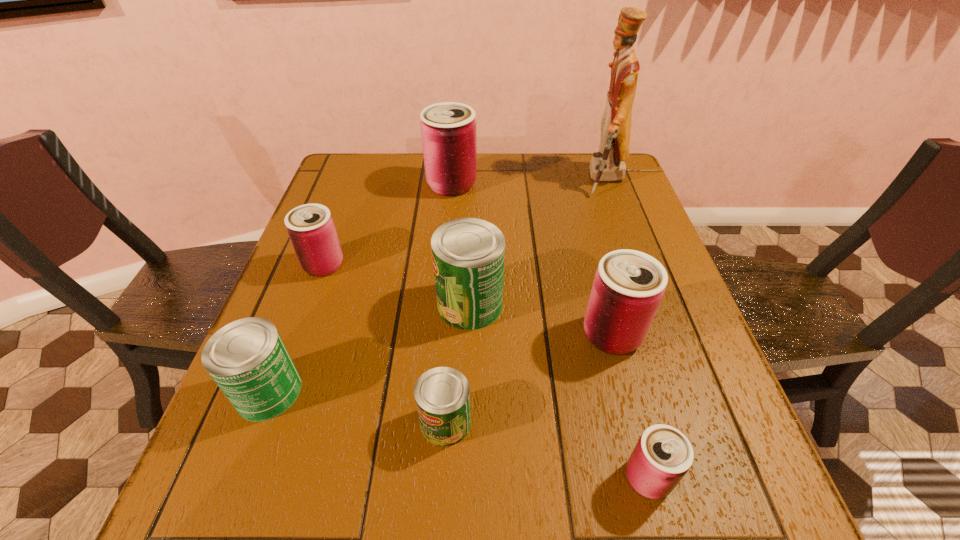
Find the location of a particular element. The width and height of the screenshot is (960, 540). nutcracker is located at coordinates pos(608,164).

You are a GUI agent. You are given a task and a screenshot of the screen. Output one action in this format:
    pyautogui.click(x=<x>, y=<y>)
    Task: Click on the red nutcracker
    The height and width of the screenshot is (540, 960).
    Given the screenshot: What is the action you would take?
    pyautogui.click(x=608, y=164)

Locate an element on the screen. the third pink can from right to left is located at coordinates (448, 129).

Locate an element on the screen. the tallest can is located at coordinates (448, 129).

Where is `the farthest green can`? the farthest green can is located at coordinates (468, 254).

Where is `the third farthest pink can`? The height and width of the screenshot is (540, 960). the third farthest pink can is located at coordinates (628, 286).

Image resolution: width=960 pixels, height=540 pixels. What are the coordinates of `the second farthest can` in the screenshot? It's located at (311, 229).

You are a GUI agent. You are given a task and a screenshot of the screen. Output one action in this format:
    pyautogui.click(x=<x>, y=<y>)
    Task: Click on the third biggest pink can
    
    Given the screenshot: What is the action you would take?
    pyautogui.click(x=311, y=229)

The image size is (960, 540). Identify the location of the leftmost green can. (247, 359).

I want to click on the smallest green can, so click(x=442, y=395).